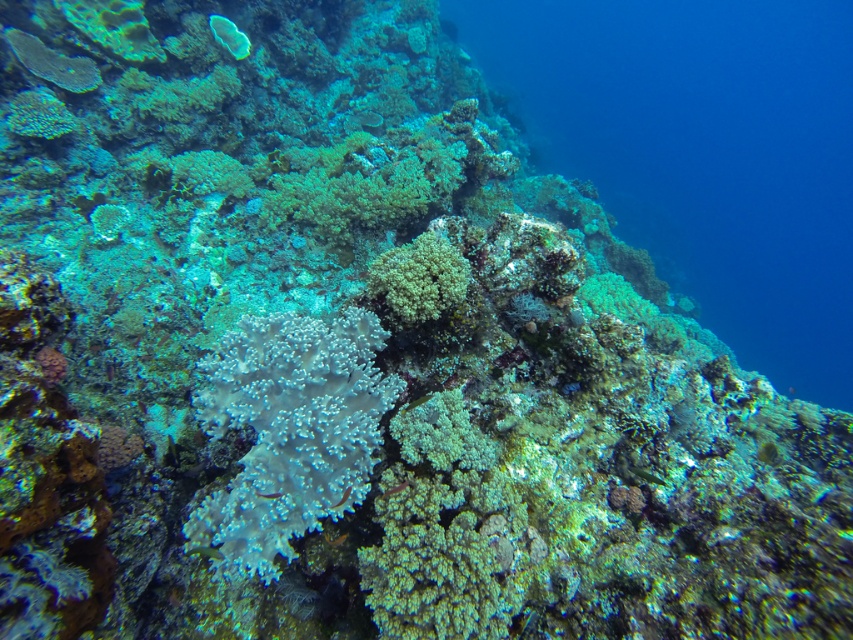
You are a diver exploring the coral reef and want to determine which point is closer to you. You see two points marked in the image, point (33, 108) and point (350, 492). Which one is closer to you?

Point (33, 108) is further to the viewer than point (350, 492). Therefore, point (350, 492) is closer to you.

You are a scuba diver swimming in the coral reef. You notice the clear blue water at center and the translucent white fish at center. Which object is located above the other?

The clear blue water at center is positioned over the translucent white fish at center, so the clear blue water at center is above the translucent white fish at center.